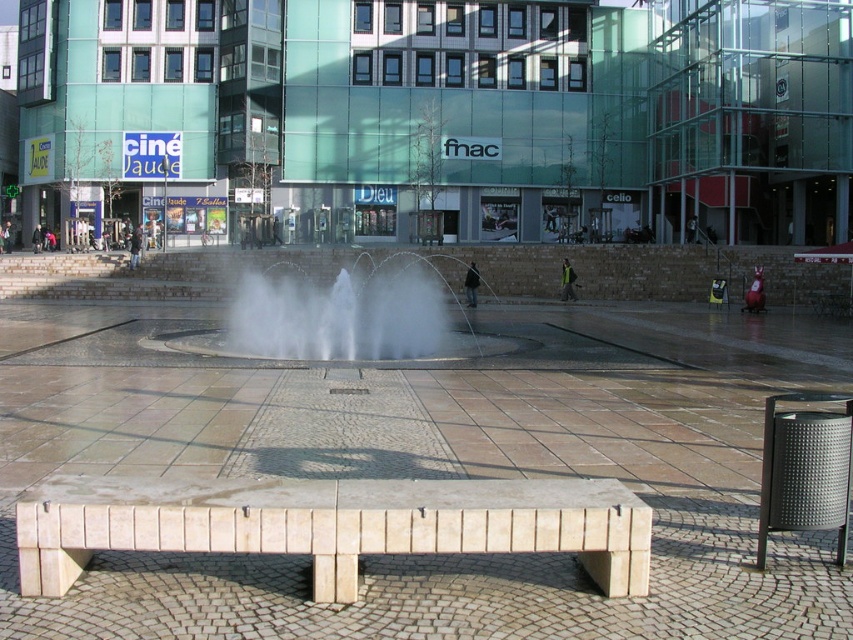
Question: Does green glass building at upper center lie in front of clear water at center?

Choices:
 (A) yes
 (B) no

Answer: (B)

Question: Which point is closer to the camera?

Choices:
 (A) (138, 509)
 (B) (115, 93)
 (C) (393, 358)

Answer: (A)

Question: Which of these objects is positioned closest to the white stone bench at center?

Choices:
 (A) clear water at center
 (B) green glass building at upper center

Answer: (A)

Question: Which point is closer to the camera?

Choices:
 (A) green glass building at upper center
 (B) clear water at center
 (C) white stone bench at center

Answer: (C)

Question: From the image, what is the correct spatial relationship of green glass building at upper center in relation to white stone bench at center?

Choices:
 (A) left
 (B) right

Answer: (A)

Question: Is green glass building at upper center bigger than white stone bench at center?

Choices:
 (A) no
 (B) yes

Answer: (B)